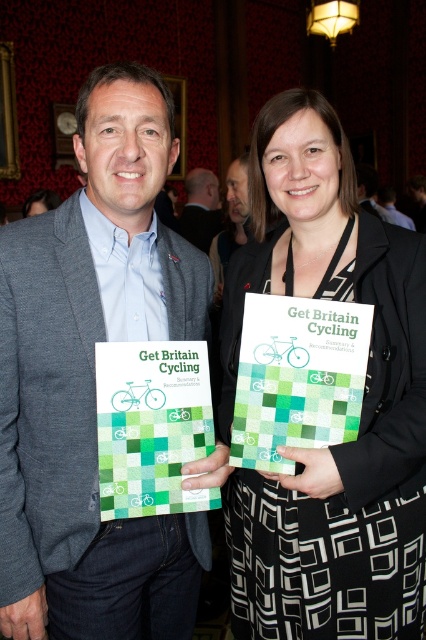
Question: Which of the following is the farthest from the observer?

Choices:
 (A) matte gray blazer at center
 (B) black textured dress at center
 (C) matte black suit at center

Answer: (C)

Question: Observing the image, what is the correct spatial positioning of matte gray blazer at center in reference to matte gray suit at center?

Choices:
 (A) right
 (B) left

Answer: (B)

Question: Based on their relative distances, which object is farther from the matte gray suit at center?

Choices:
 (A) black textured dress at center
 (B) matte black suit at center

Answer: (A)

Question: Estimate the real-world distances between objects in this image. Which object is closer to the black textured dress at center?

Choices:
 (A) matte black suit at center
 (B) matte gray suit at center
 (C) matte gray blazer at center

Answer: (C)

Question: Does matte gray blazer at center lie in front of matte black suit at center?

Choices:
 (A) yes
 (B) no

Answer: (A)

Question: Observing the image, what is the correct spatial positioning of matte gray blazer at center in reference to matte black suit at center?

Choices:
 (A) above
 (B) below

Answer: (B)